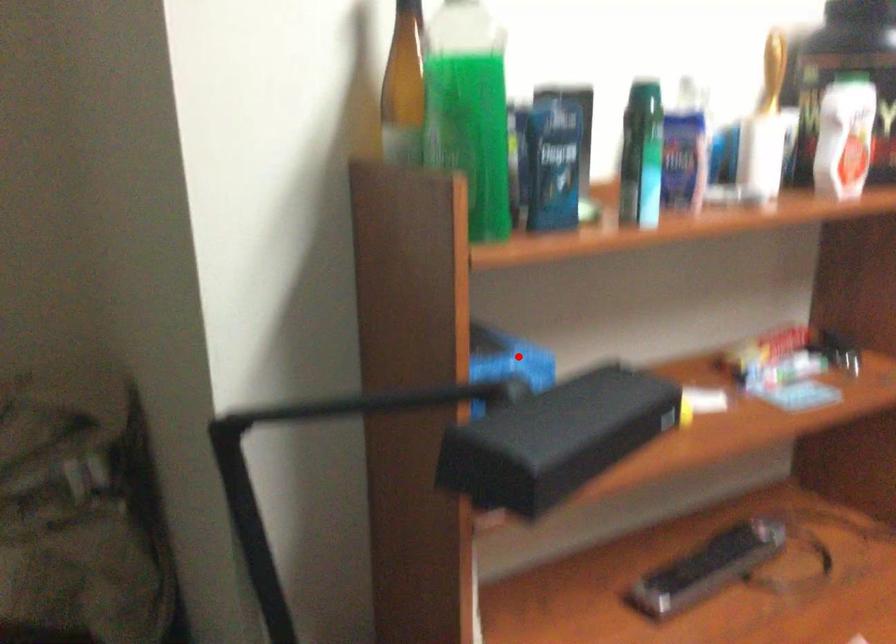
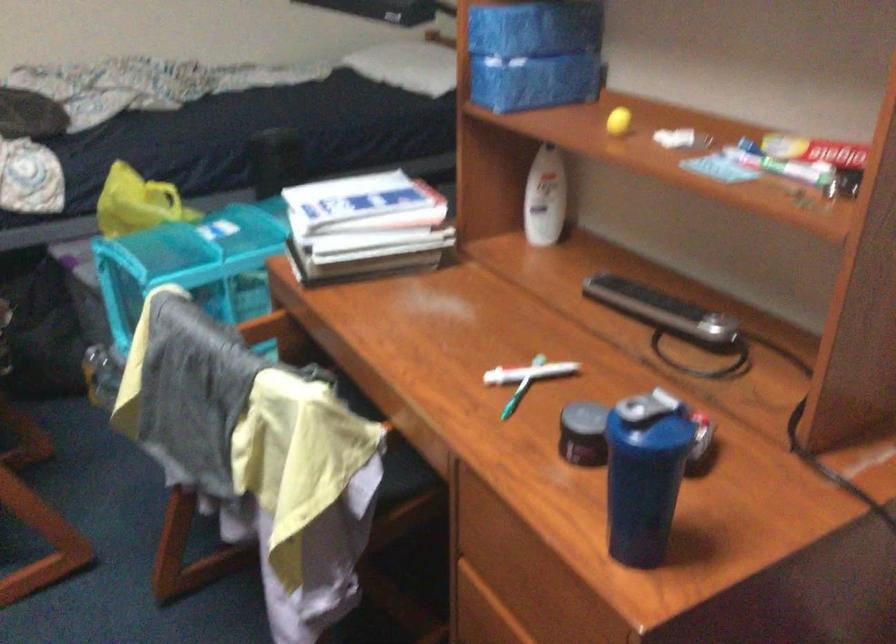
Question: A red point is marked in image1. In image2, is the corresponding 3D point closer to the camera or farther? Reply with the corresponding letter.

Choices:
 (A) The corresponding 3D point is closer.
 (B) The corresponding 3D point is farther.

Answer: (B)